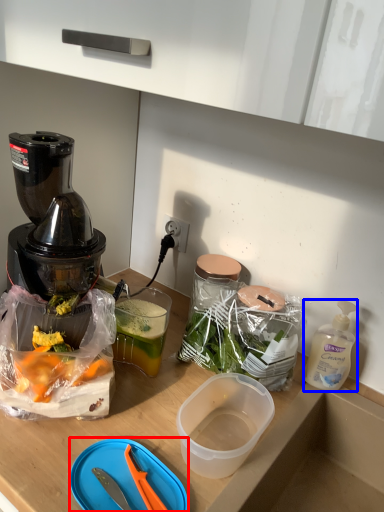
Question: Which object appears closest to the camera in this image, cutting board (highlighted by a red box) or bottle (highlighted by a blue box)?

Choices:
 (A) cutting board
 (B) bottle

Answer: (A)